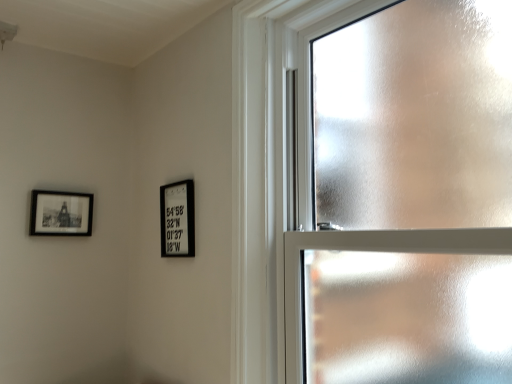
Question: Does frosted glass window at upper right appear on the left side of matte black picture frame at upper left, placed as the first picture frame when sorted from left to right?

Choices:
 (A) yes
 (B) no

Answer: (B)

Question: Can you confirm if frosted glass window at upper right is taller than matte black picture frame at upper left, placed as the 2th picture frame when sorted from right to left?

Choices:
 (A) no
 (B) yes

Answer: (B)

Question: Is frosted glass window at upper right to the right of matte black picture frame at upper left, placed as the first picture frame when sorted from left to right, from the viewer's perspective?

Choices:
 (A) no
 (B) yes

Answer: (B)

Question: Does frosted glass window at upper right have a smaller size compared to matte black picture frame at upper left, placed as the first picture frame when sorted from left to right?

Choices:
 (A) yes
 (B) no

Answer: (B)

Question: Can you confirm if frosted glass window at upper right is thinner than matte black picture frame at upper left, placed as the first picture frame when sorted from left to right?

Choices:
 (A) no
 (B) yes

Answer: (A)

Question: Considering the positions of point (441, 21) and point (168, 241), is point (441, 21) closer or farther from the camera than point (168, 241)?

Choices:
 (A) closer
 (B) farther

Answer: (A)

Question: From the image's perspective, is frosted glass window at upper right located above or below black matte picture frame at center, the second picture frame in the left-to-right sequence?

Choices:
 (A) below
 (B) above

Answer: (B)

Question: Looking at the image, does frosted glass window at upper right seem bigger or smaller compared to black matte picture frame at center, the second picture frame in the left-to-right sequence?

Choices:
 (A) big
 (B) small

Answer: (A)

Question: In the image, is frosted glass window at upper right on the left side or the right side of black matte picture frame at center, the first picture frame viewed from the right?

Choices:
 (A) right
 (B) left

Answer: (A)

Question: Is point (178, 213) closer or farther from the camera than point (33, 215)?

Choices:
 (A) closer
 (B) farther

Answer: (A)

Question: Looking at their shapes, would you say black matte picture frame at center, the first picture frame viewed from the right, is wider or thinner than matte black picture frame at upper left, placed as the 2th picture frame when sorted from right to left?

Choices:
 (A) wide
 (B) thin

Answer: (A)

Question: From a real-world perspective, is black matte picture frame at center, the second picture frame in the left-to-right sequence, above or below matte black picture frame at upper left, placed as the first picture frame when sorted from left to right?

Choices:
 (A) below
 (B) above

Answer: (A)

Question: Choose the correct answer: Is black matte picture frame at center, the second picture frame in the left-to-right sequence, inside matte black picture frame at upper left, placed as the 2th picture frame when sorted from right to left, or outside it?

Choices:
 (A) outside
 (B) inside

Answer: (A)

Question: Considering their positions, is matte black picture frame at upper left, placed as the 2th picture frame when sorted from right to left, located in front of or behind black matte picture frame at center, the first picture frame viewed from the right?

Choices:
 (A) behind
 (B) front

Answer: (A)

Question: Is matte black picture frame at upper left, placed as the first picture frame when sorted from left to right, inside the boundaries of black matte picture frame at center, the second picture frame in the left-to-right sequence, or outside?

Choices:
 (A) outside
 (B) inside

Answer: (A)